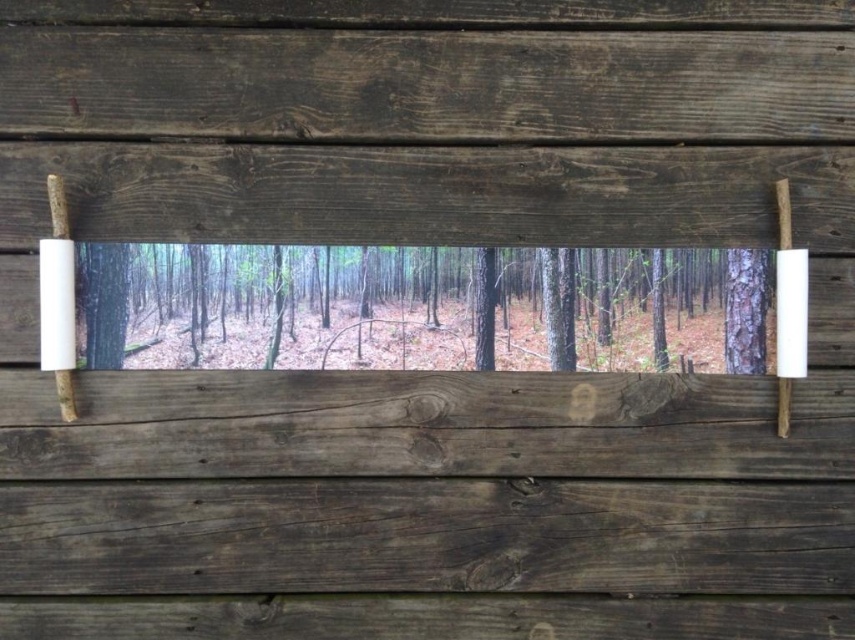
You are an interior designer planning to hang the rustic wooden frame on a wall. The frame has a dark wood plank at center and a green matte tree at center. You need to ensure there is at least 5 inches of space between these two elements for aesthetic balance. Based on the image, is the current spacing sufficient?

The distance between the dark wood plank at center and the green matte tree at center is 4.27 inches, which is less than the required 5 inches. Therefore, the current spacing is insufficient for the desired aesthetic balance.

You are standing in front of the rustic wooden frame and want to place a small decoration between the dark brown wood at center and the smooth brown tree trunk at right. Based on their positions, which object should you place the decoration closer to the left side of the frame?

The dark brown wood at center is to the left of the smooth brown tree trunk at right, so you should place the decoration closer to the left side of the frame near the dark brown wood at center.